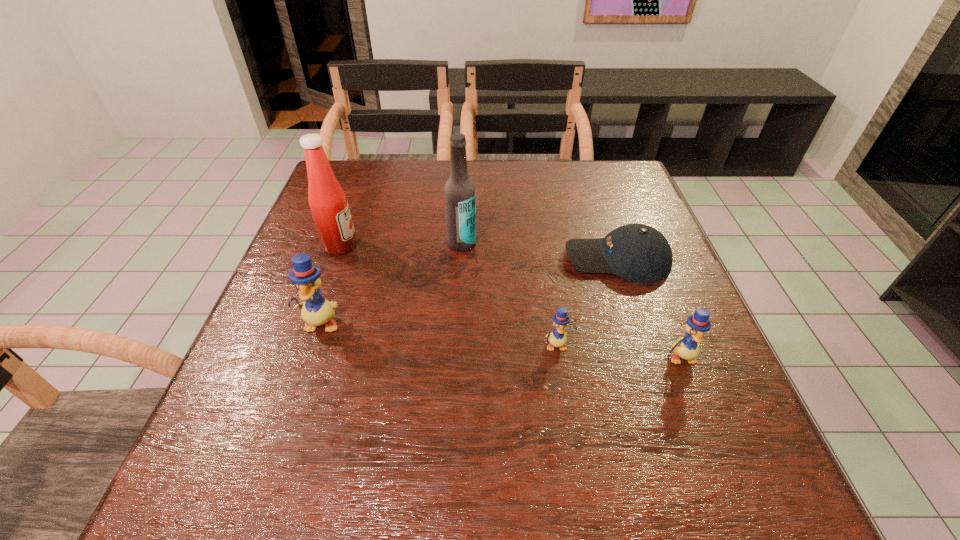
You are a GUI agent. You are given a task and a screenshot of the screen. Output one action in this format:
    pyautogui.click(x=<x>, y=<y>)
    Task: Click on the empty location between the farthest duckling and the third object from right to left
    The width and height of the screenshot is (960, 540).
    Given the screenshot: What is the action you would take?
    pyautogui.click(x=438, y=335)

What are the coordinates of `vacant area that lies between the condiment and the rightmost duckling` in the screenshot? It's located at (511, 301).

The image size is (960, 540). I want to click on free area in between the third object from left to right and the condiment, so (x=401, y=245).

This screenshot has width=960, height=540. I want to click on vacant area between the third object from right to left and the beer bottle, so click(509, 294).

Where is `blank region between the shortest duckling and the third shortest object`? blank region between the shortest duckling and the third shortest object is located at coordinates (618, 352).

Find the location of a particular element. vacant space that is in between the fourth shortest object and the condiment is located at coordinates (330, 285).

Locate which object ranks second in proximity to the baseball cap. Please provide its 2D coordinates. Your answer should be formatted as a tuple, i.e. [(x, y)], where the tuple contains the x and y coordinates of a point satisfying the conditions above.

[(687, 347)]

You are a GUI agent. You are given a task and a screenshot of the screen. Output one action in this format:
    pyautogui.click(x=<x>, y=<y>)
    Task: Click on the object identified as the third closest to the baseball cap
    
    Given the screenshot: What is the action you would take?
    click(459, 192)

Identify which duckling is the second nearest to the farthest duckling. Please provide its 2D coordinates. Your answer should be formatted as a tuple, i.e. [(x, y)], where the tuple contains the x and y coordinates of a point satisfying the conditions above.

[(687, 347)]

The height and width of the screenshot is (540, 960). Find the location of `duckling that can be found as the closest to the third tallest object`. duckling that can be found as the closest to the third tallest object is located at coordinates (557, 338).